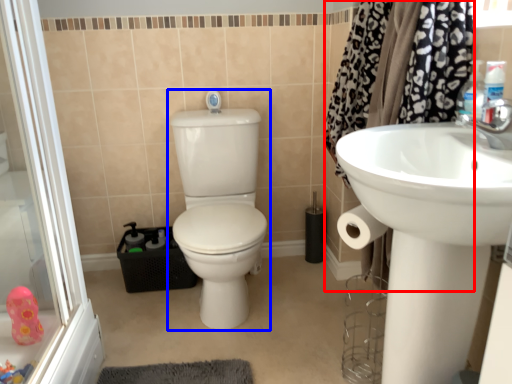
Question: Which of the following is the farthest to the observer, shower curtain (highlighted by a red box) or sit (highlighted by a blue box)?

Choices:
 (A) shower curtain
 (B) sit

Answer: (B)